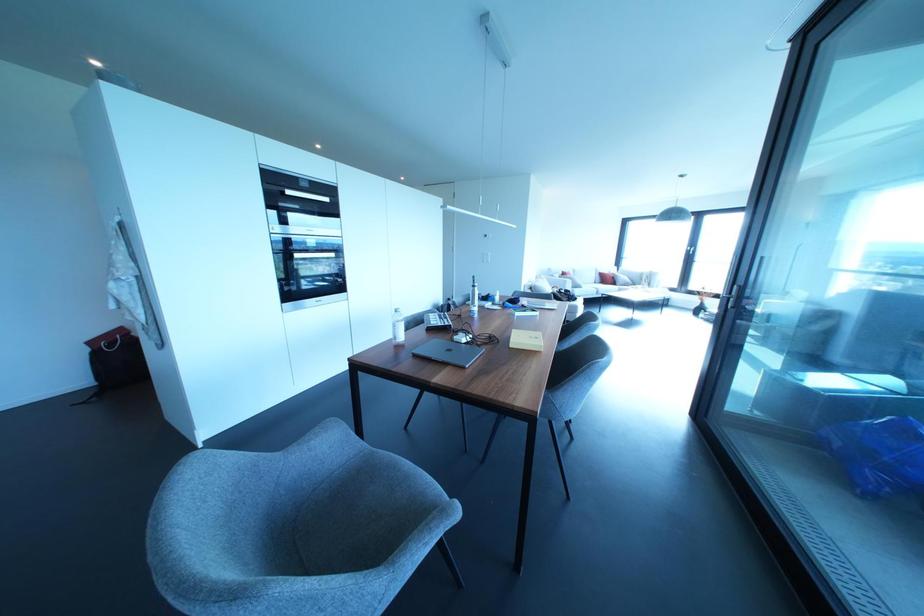
This screenshot has height=616, width=924. What do you see at coordinates (599, 286) in the screenshot?
I see `the white sofa sitting surface` at bounding box center [599, 286].